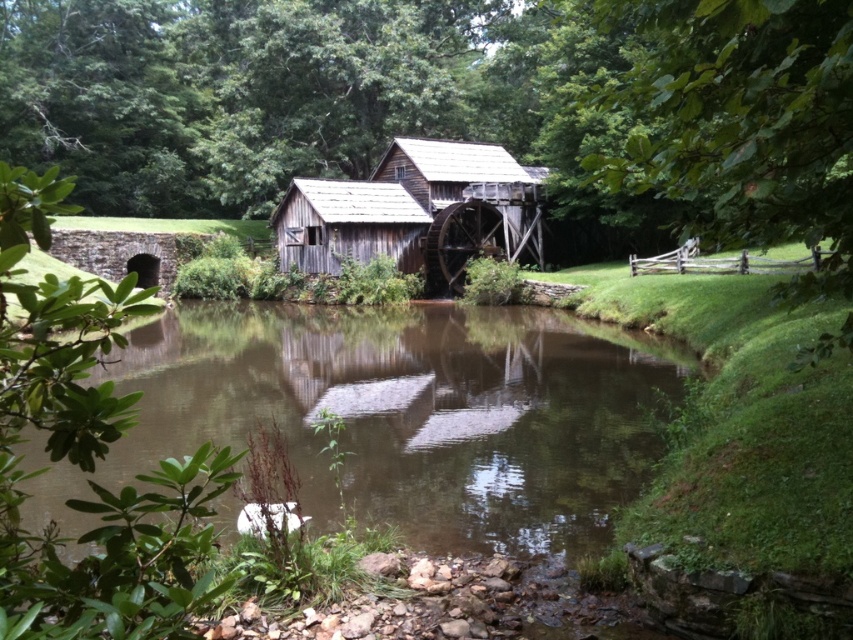
You are a painter planning to capture the rural scene. You need to decide the canvas size based on the width of the brown reflective water at center and the green leafy tree at right. Which object should you prioritize in terms of width for your painting composition?

The brown reflective water at center has a greater width than the green leafy tree at right, so you should prioritize the brown reflective water at center in terms of width for your painting composition.